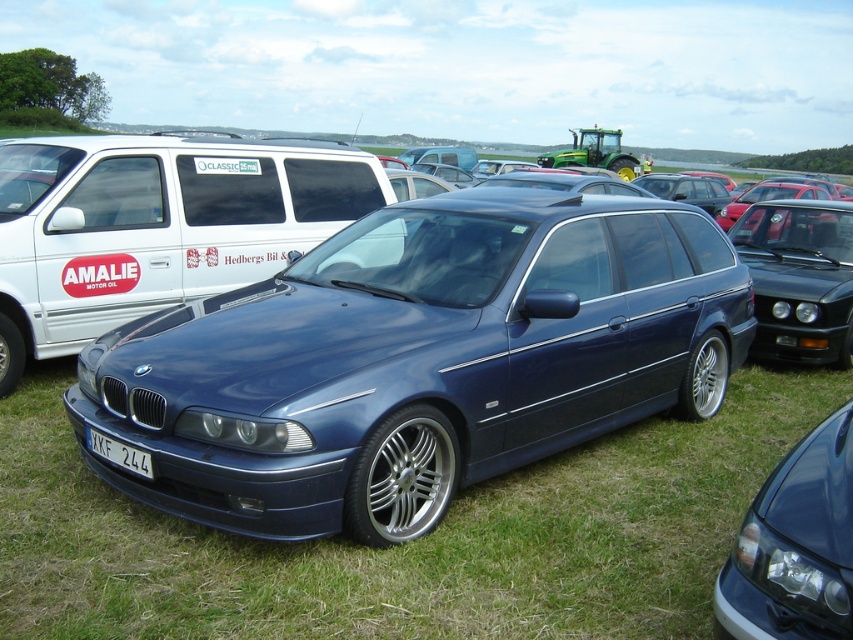
You are a photographer at the car event. You need to capture both the metallic blue minivan at center and the satin black car at center in a single frame. Which vehicle should you position closer to the camera to ensure both fit in the frame?

The metallic blue minivan at center is larger in size compared to the satin black car at center. To ensure both fit in the frame, position the smaller satin black car at center closer to the camera while keeping the metallic blue minivan at center farther back.

You are a photographer at the car event. You want to take a photo of the white matte van at center without any obstructions. Is the white plastic license plate at lower center blocking the view of the van?

The white plastic license plate at lower center is behind the white matte van at center, so it does not block the view of the van.